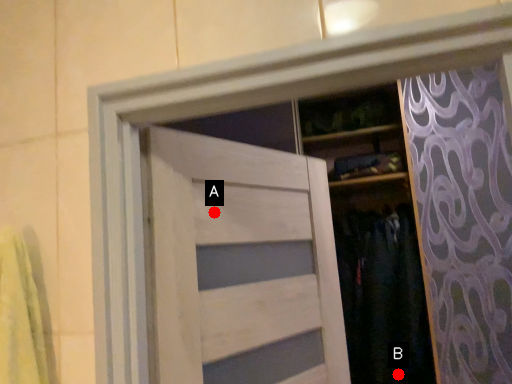
Question: Two points are circled on the image, labeled by A and B beside each circle. Which point is closer to the camera?

Choices:
 (A) A is closer
 (B) B is closer

Answer: (A)